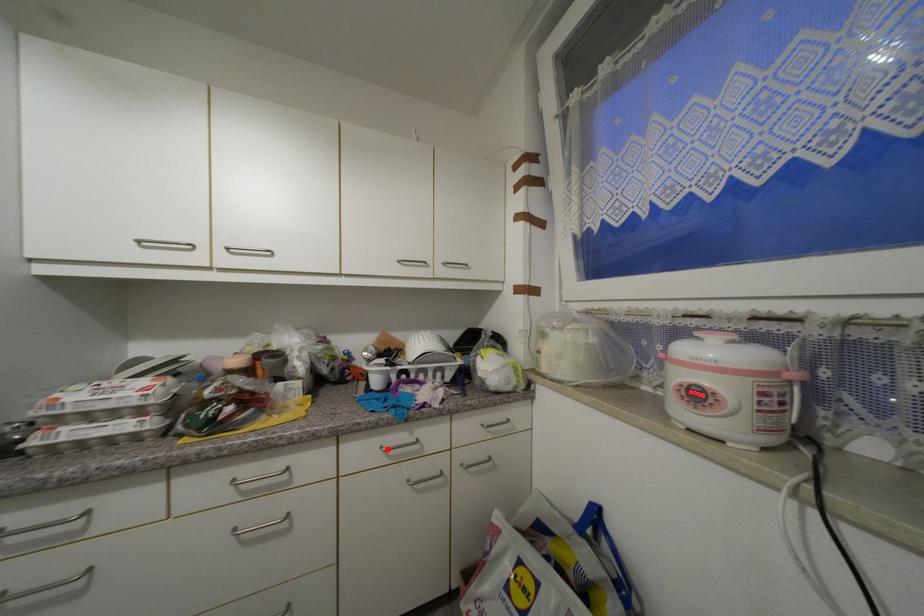
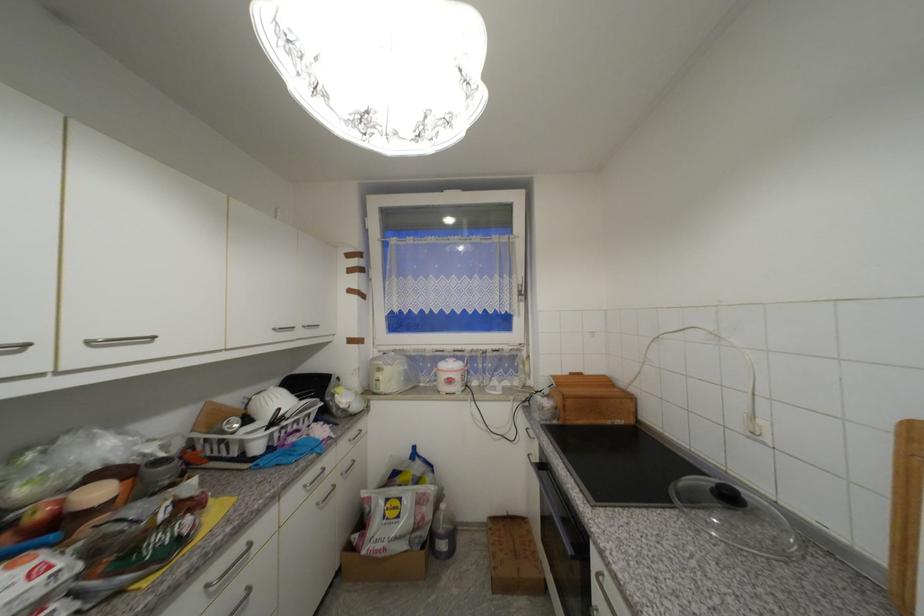
Locate, in the second image, the point that corresponds to the highlighted location in the first image.

(310, 488)